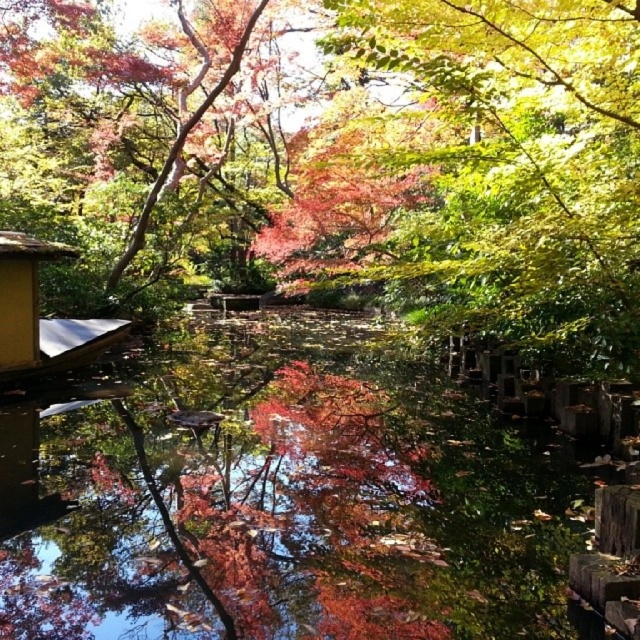
Question: Can you confirm if shiny red leaves at upper center is positioned above yellow wood hut at lower left?

Choices:
 (A) yes
 (B) no

Answer: (A)

Question: Which object appears closest to the camera in this image?

Choices:
 (A) shiny red leaves at upper center
 (B) yellow wood hut at lower left

Answer: (A)

Question: Which point is closer to the camera?

Choices:
 (A) (262, 509)
 (B) (42, 365)

Answer: (A)

Question: Is the position of shiny red leaves at upper center more distant than that of yellow wood hut at lower left?

Choices:
 (A) yes
 (B) no

Answer: (B)

Question: Is transparent water at center wider than yellow wood hut at lower left?

Choices:
 (A) no
 (B) yes

Answer: (B)

Question: Which point appears farthest from the camera in this image?

Choices:
 (A) (476, 24)
 (B) (332, 552)
 (C) (44, 356)

Answer: (C)